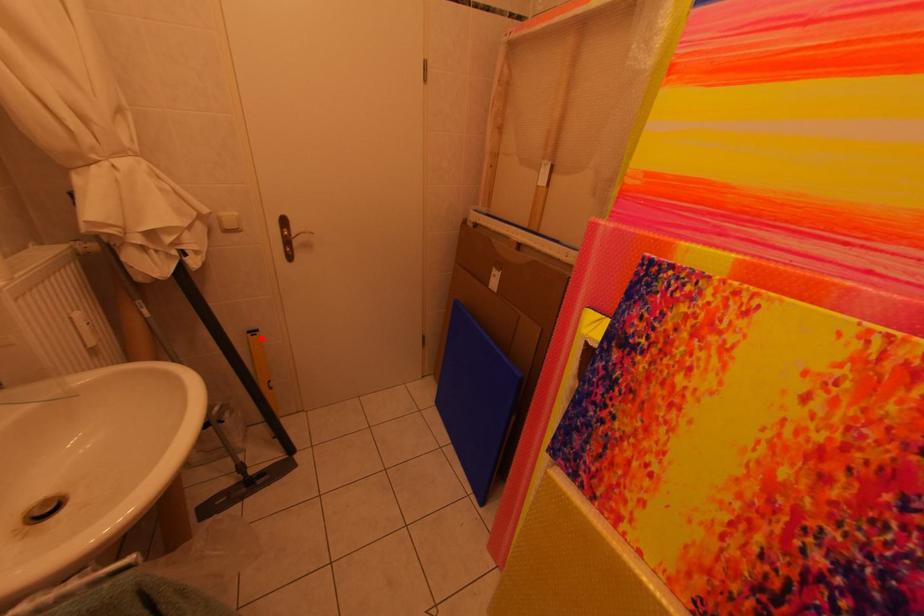
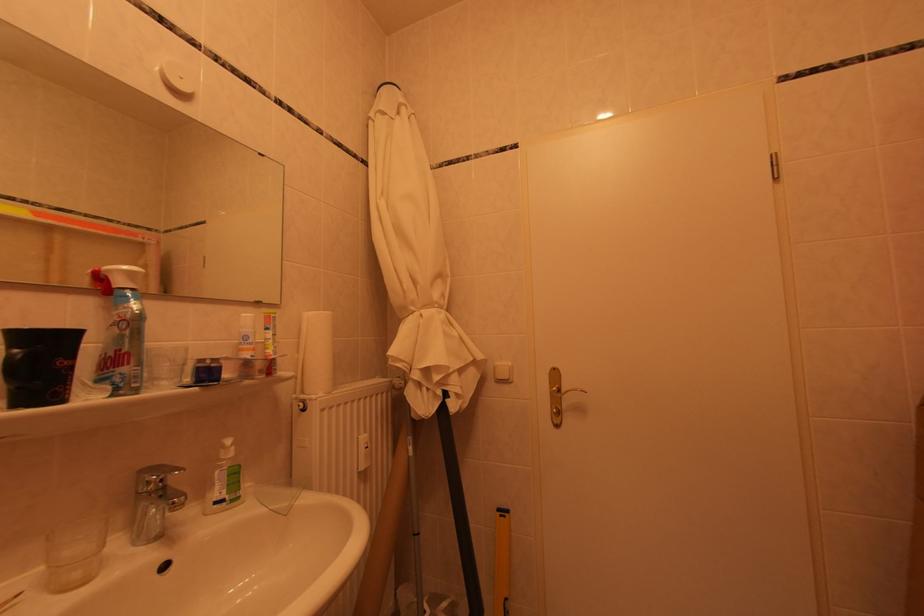
Locate, in the second image, the point that corresponds to the highlighted location in the first image.

(509, 519)